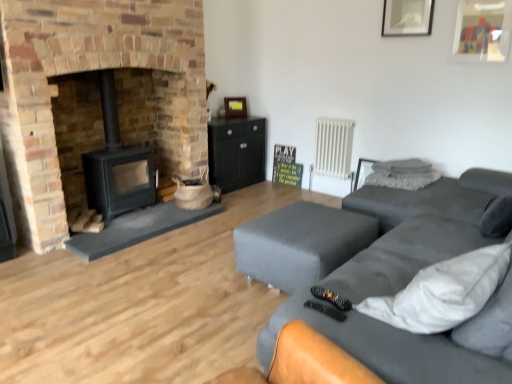
Question: Is black matte wood burning stove at left next to white textured pillow at upper right, the first pillow viewed from the top?

Choices:
 (A) no
 (B) yes

Answer: (A)

Question: Is black matte wood burning stove at left facing towards white textured pillow at upper right, the first pillow viewed from the top?

Choices:
 (A) yes
 (B) no

Answer: (B)

Question: From the image's perspective, is black matte wood burning stove at left on top of white textured pillow at upper right, the first pillow viewed from the top?

Choices:
 (A) no
 (B) yes

Answer: (B)

Question: Does black matte wood burning stove at left have a greater height compared to white textured pillow at upper right, the first pillow viewed from the top?

Choices:
 (A) yes
 (B) no

Answer: (A)

Question: Is black matte wood burning stove at left outside of white textured pillow at upper right, the 2th pillow in the bottom-to-top sequence?

Choices:
 (A) no
 (B) yes

Answer: (B)

Question: Considering the positions of point (86, 187) and point (459, 200), is point (86, 187) closer or farther from the camera than point (459, 200)?

Choices:
 (A) closer
 (B) farther

Answer: (B)

Question: Looking at the image, does black matte wood burning stove at left seem bigger or smaller compared to matte gray fabric couch at right?

Choices:
 (A) big
 (B) small

Answer: (B)

Question: Is black matte wood burning stove at left taller or shorter than matte gray fabric couch at right?

Choices:
 (A) short
 (B) tall

Answer: (B)

Question: Is black matte wood burning stove at left wider or thinner than matte gray fabric couch at right?

Choices:
 (A) wide
 (B) thin

Answer: (B)

Question: Relative to white textured pillow at upper right, which ranks as the second pillow in top-to-bottom order, is white textured pillow at upper right, the first pillow viewed from the top, in front or behind?

Choices:
 (A) behind
 (B) front

Answer: (A)

Question: From the image's perspective, is white textured pillow at upper right, the 2th pillow in the bottom-to-top sequence, above or below white textured pillow at upper right, which ranks as the second pillow in top-to-bottom order?

Choices:
 (A) below
 (B) above

Answer: (B)

Question: Considering the positions of white textured pillow at upper right, the first pillow viewed from the top, and white textured pillow at upper right, which is the first pillow in bottom-to-top order, in the image, is white textured pillow at upper right, the first pillow viewed from the top, taller or shorter than white textured pillow at upper right, which is the first pillow in bottom-to-top order,?

Choices:
 (A) tall
 (B) short

Answer: (B)

Question: From a real-world perspective, relative to white textured pillow at upper right, which is the first pillow in bottom-to-top order, is white textured pillow at upper right, the first pillow viewed from the top, vertically above or below?

Choices:
 (A) below
 (B) above

Answer: (B)

Question: Considering the positions of brick fireplace at left and black matte cabinet at center in the image, is brick fireplace at left wider or thinner than black matte cabinet at center?

Choices:
 (A) wide
 (B) thin

Answer: (A)

Question: From a real-world perspective, is brick fireplace at left physically located above or below black matte cabinet at center?

Choices:
 (A) above
 (B) below

Answer: (A)